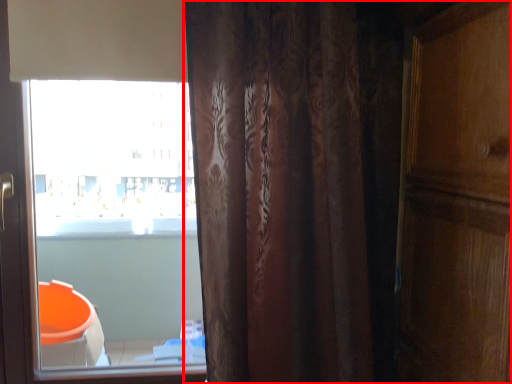
Question: From the image's perspective, what is the correct spatial relationship of curtain (annotated by the red box) in relation to window?

Choices:
 (A) above
 (B) below

Answer: (B)